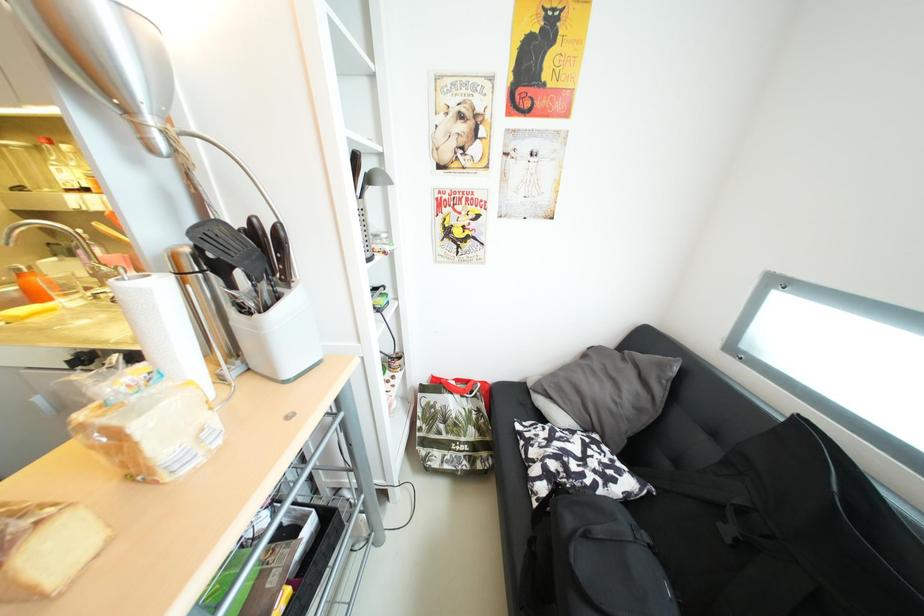
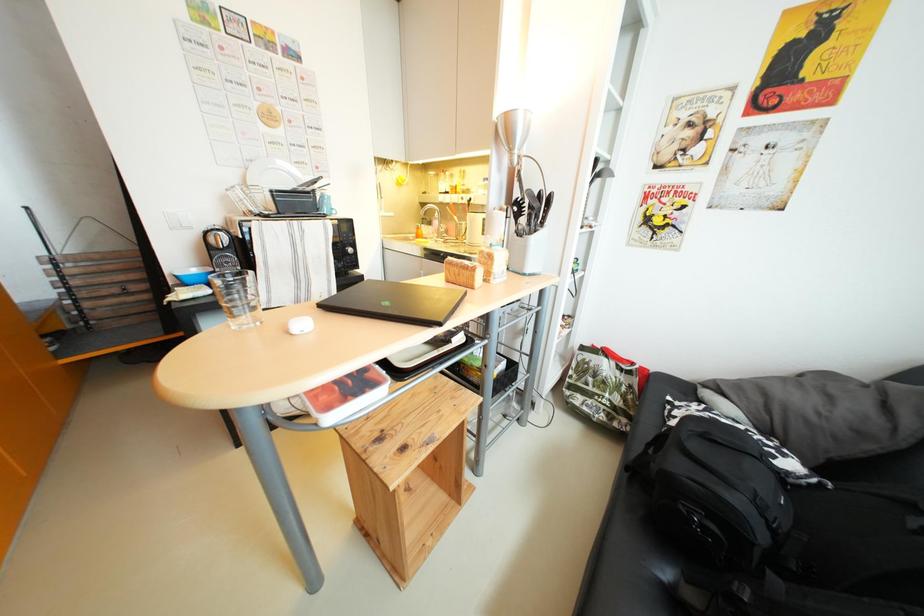
Question: Based on the continuous images, in which direction is the camera rotating? Reply with the corresponding letter.

Choices:
 (A) Left
 (B) Right
 (C) Up
 (D) Down

Answer: (A)